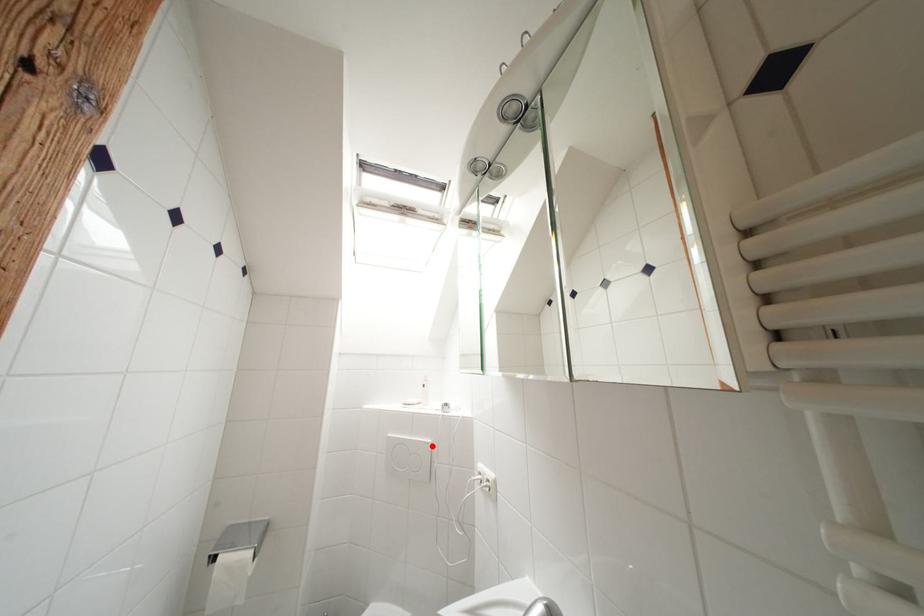
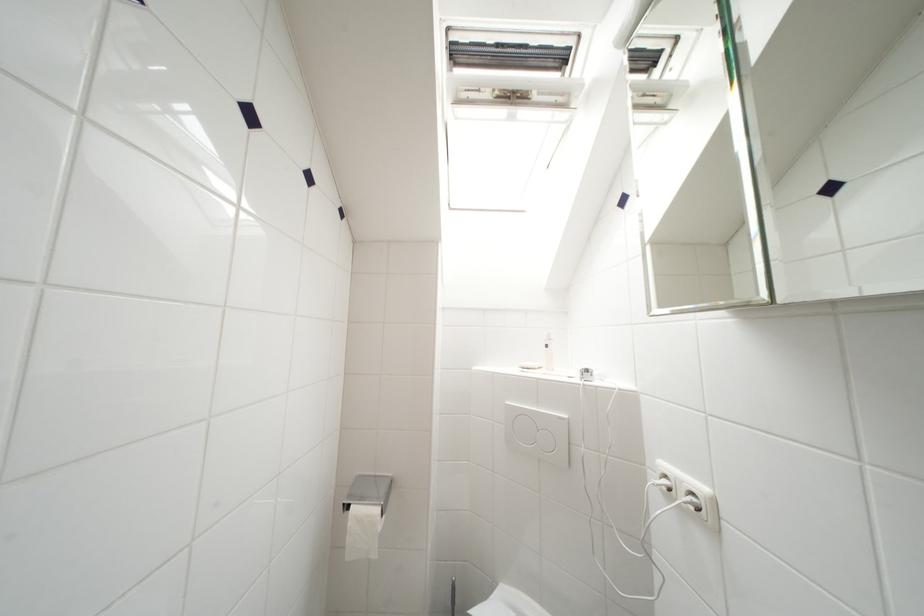
Question: I am providing you with two images of the same scene from different viewpoints. Given a red point in image1, look at the same physical point in image2. Is it:

Choices:
 (A) Closer to the viewpoint
 (B) Farther from the viewpoint

Answer: (A)